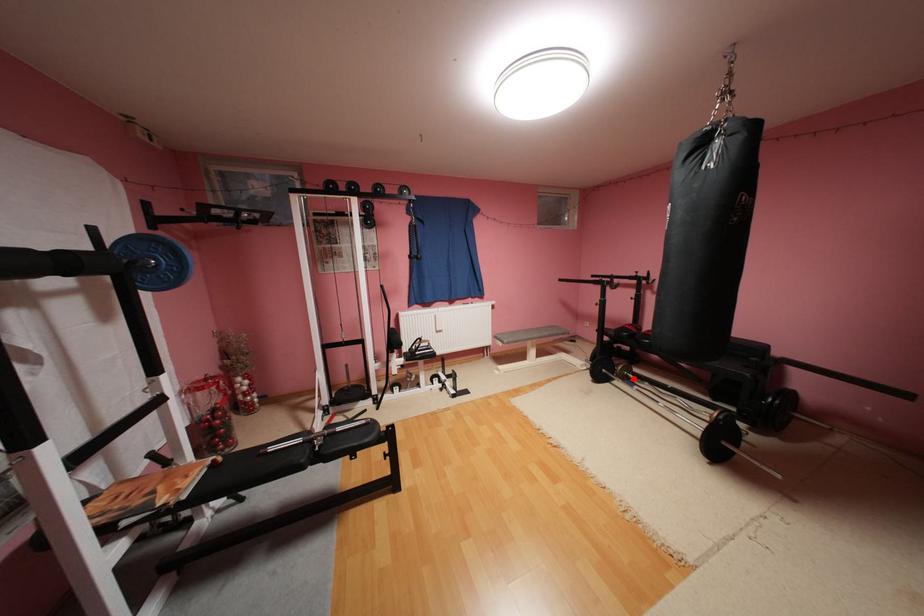
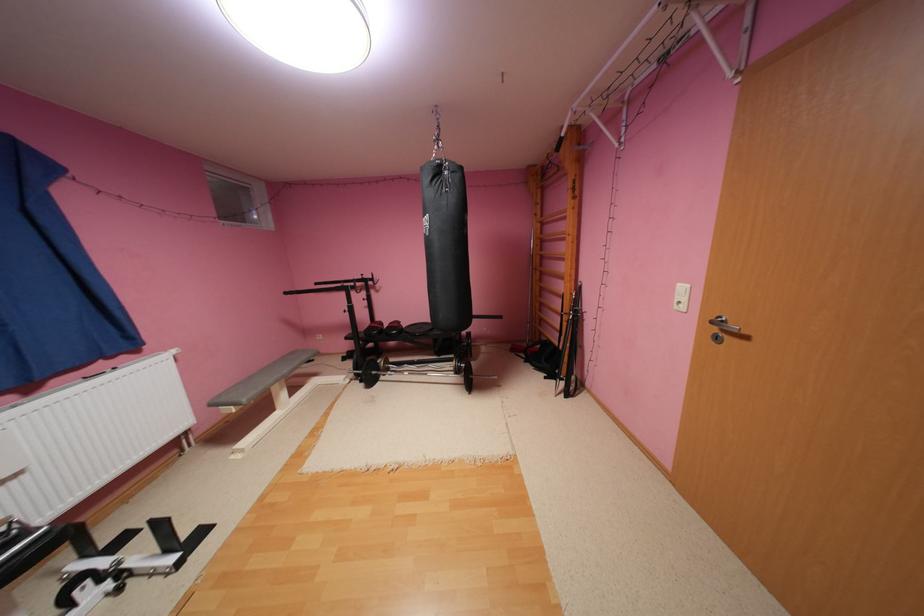
Question: I am providing you with two images of the same scene from different viewpoints. Given a red point in image1, look at the same physical point in image2. Is it:

Choices:
 (A) Closer to the viewpoint
 (B) Farther from the viewpoint

Answer: (A)